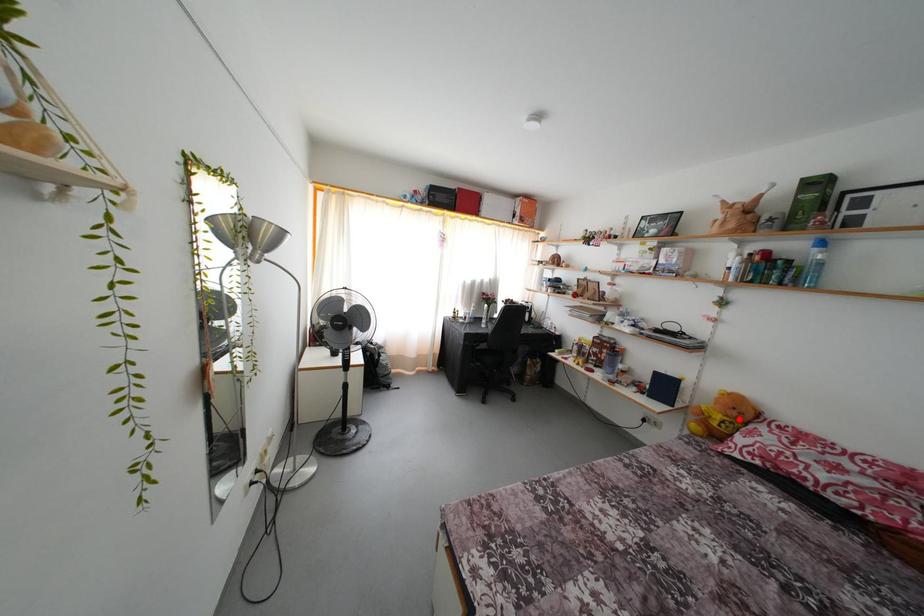
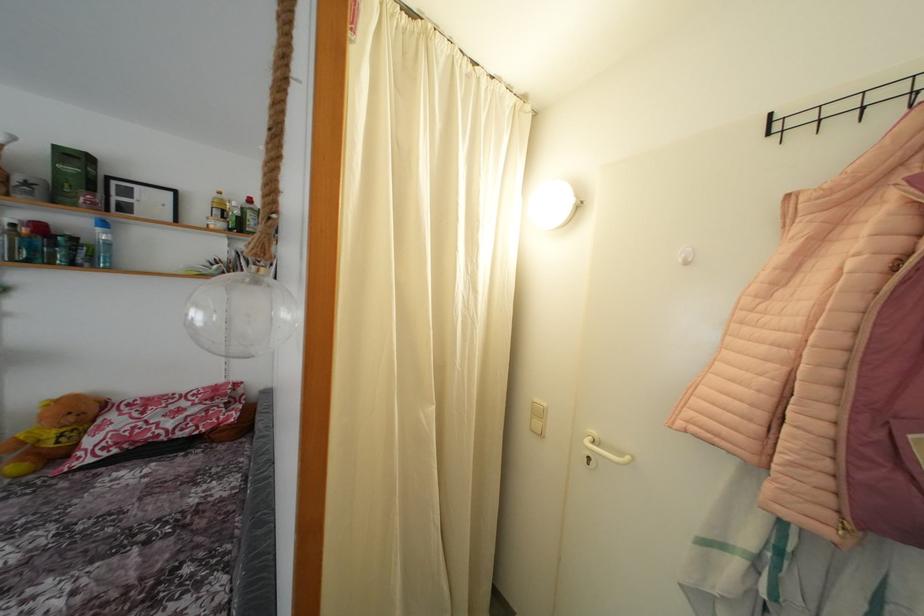
Question: I am providing you with two images of the same scene from different viewpoints. Given a red point in image1, look at the same physical point in image2. Is it:

Choices:
 (A) Closer to the viewpoint
 (B) Farther from the viewpoint

Answer: (A)